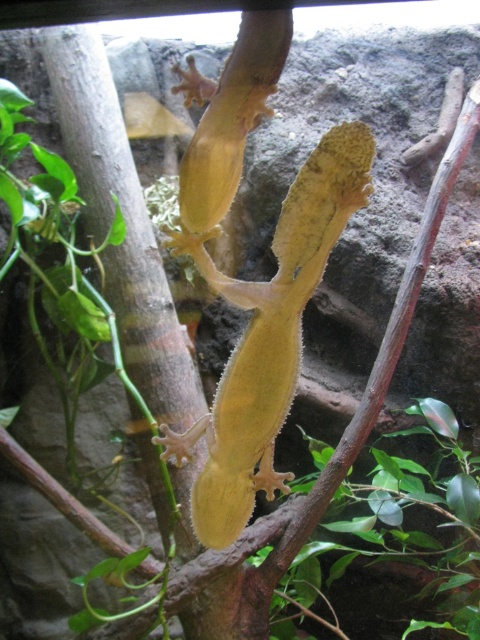
Between point (304, 252) and point (435, 628), which one is positioned in front?

Positioned in front is point (304, 252).

Is yellow matte lizard at center behind green matte leaf at center?

That is False.

Locate an element on the screen. yellow matte lizard at center is located at coordinates (267, 337).